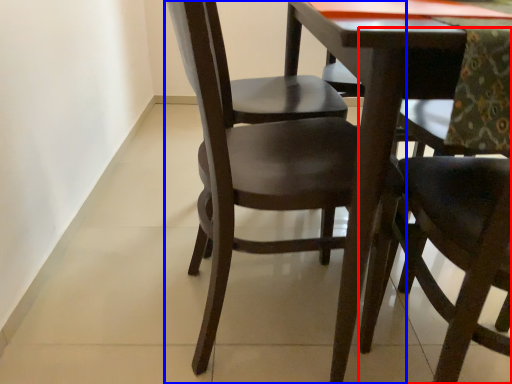
Question: Which object appears closest to the camera in this image, chair (highlighted by a red box) or chair (highlighted by a blue box)?

Choices:
 (A) chair
 (B) chair

Answer: (A)